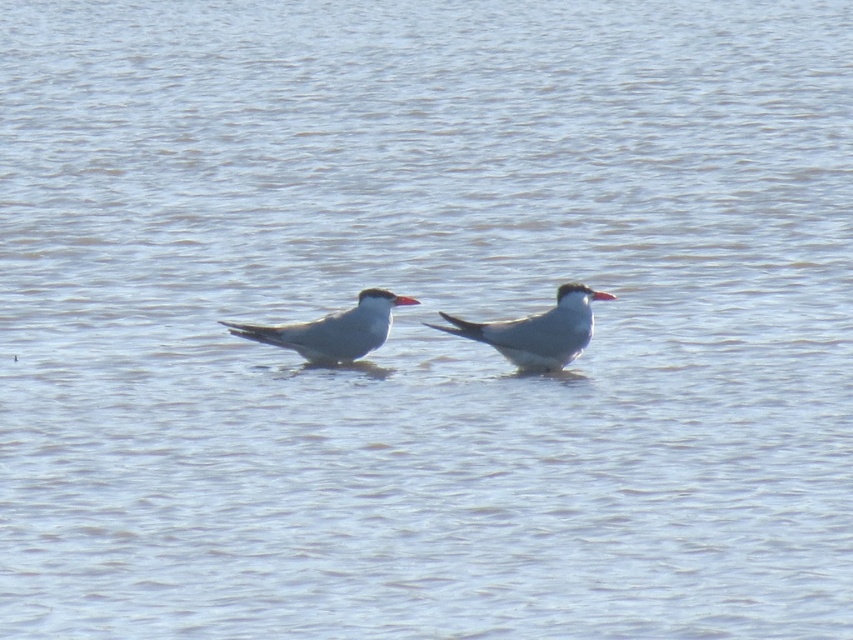
You are a birdwatcher observing the two birds in the scene. You notice both the white glossy seagull at center and the red glossy beak at center. Which object is taller?

The white glossy seagull at center is taller than the red glossy beak at center.

You are a photographer positioned at the center of the scene. You want to capture a closeup shot of the white glossy bird at center. Which direction should you move your camera to focus on it?

The white glossy bird at center is located at coordinates 0.519 on the x axis and 0.628 on the y axis. Since the photographer is at the center of the scene, which is at coordinates (x=0, y=0), they should move the camera slightly to the right and upwards to focus on the bird.